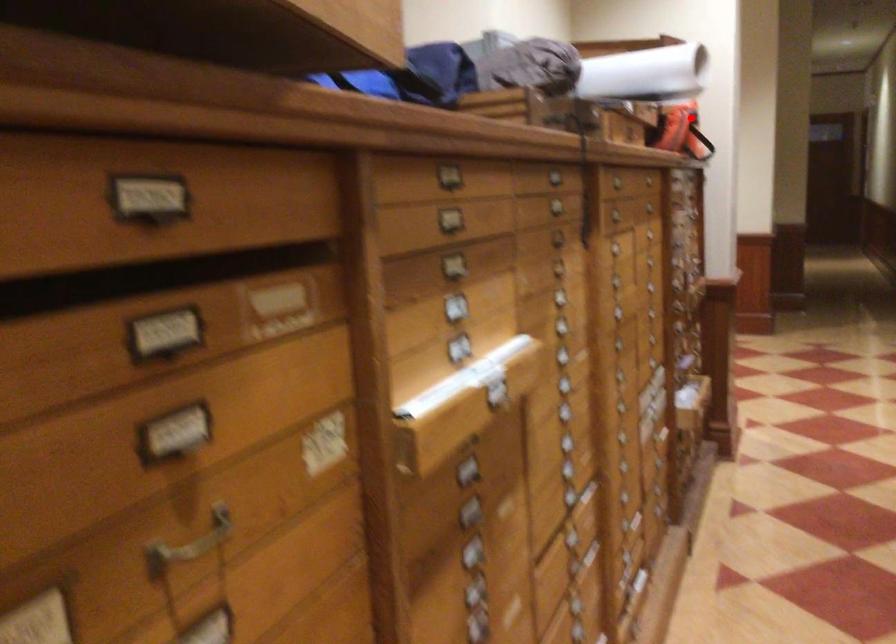
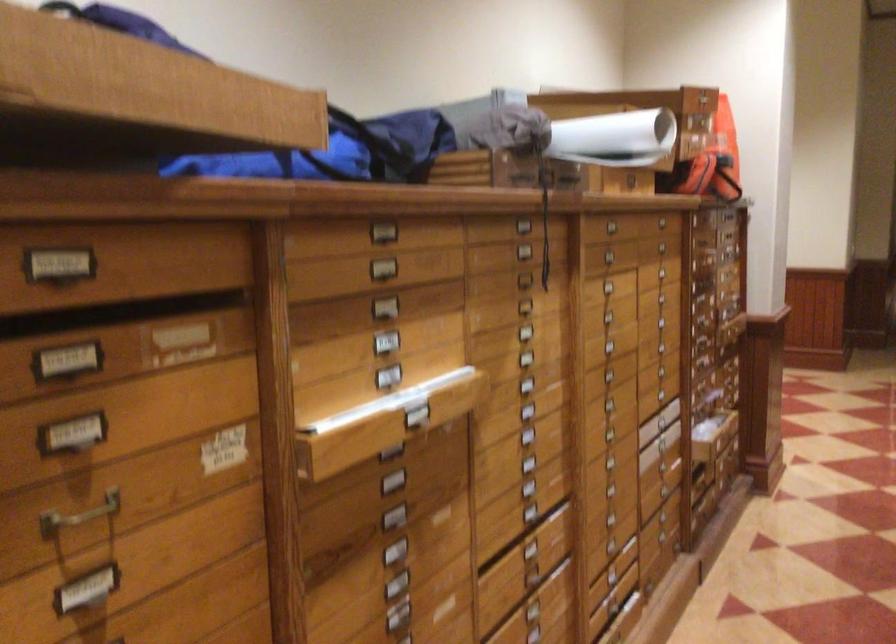
The point at the highlighted location is marked in the first image. Where is the corresponding point in the second image?

(717, 160)